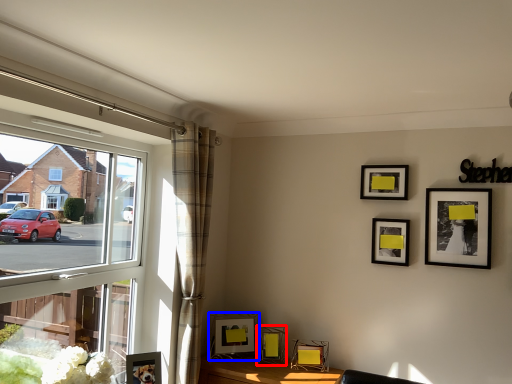
Question: Which of the following is the farthest to the observer, picture frame (highlighted by a red box) or picture frame (highlighted by a blue box)?

Choices:
 (A) picture frame
 (B) picture frame

Answer: (B)